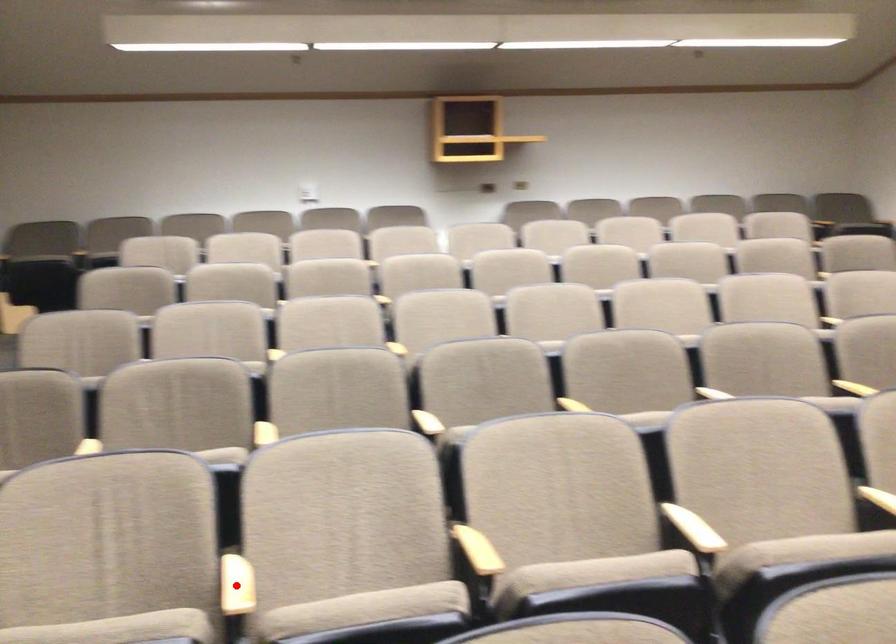
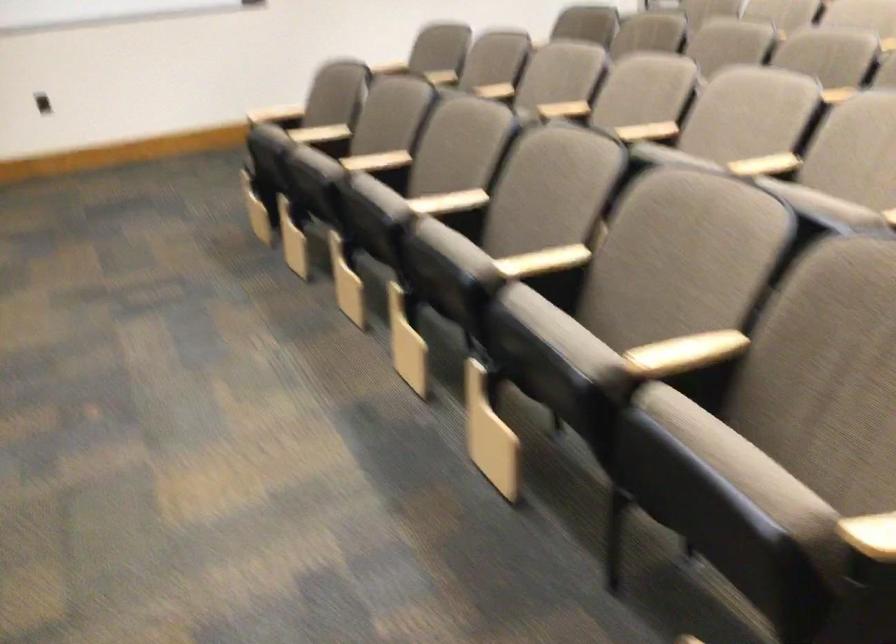
Question: I am providing you with two images of the same scene from different viewpoints. A red point is marked on the first image. At the location where the point appears in image 1, is it still visible in image 2?

Choices:
 (A) Yes
 (B) No

Answer: (B)